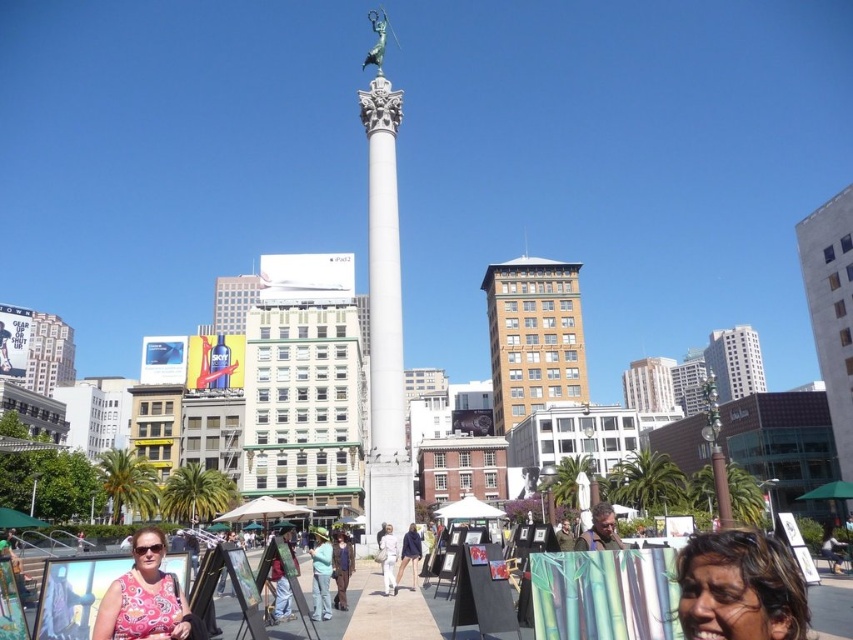
Does light blue denim jeans at center appear on the right side of white cotton pants at center?

Incorrect, light blue denim jeans at center is not on the right side of white cotton pants at center.

Is point (335, 605) less distant than point (387, 545)?

Yes.

Locate an element on the screen. Image resolution: width=853 pixels, height=640 pixels. light blue denim jeans at center is located at coordinates (341, 568).

Is denim pants at center behind white cotton pants at center?

No, denim pants at center is closer to the viewer.

Between point (321, 593) and point (381, 536), which one is positioned in front?

Point (321, 593) is more forward.

Is point (312, 618) closer to camera compared to point (386, 566)?

Yes.

You are a GUI agent. You are given a task and a screenshot of the screen. Output one action in this format:
    pyautogui.click(x=<x>, y=<y>)
    Task: Click on the denim pants at center
    This screenshot has height=640, width=853.
    Given the screenshot: What is the action you would take?
    pyautogui.click(x=321, y=573)

Who is higher up, pink fabric at lower left or matte brown jacket at lower right?

pink fabric at lower left

Between point (149, 577) and point (598, 515), which one is positioned behind?

The point (598, 515) is behind.

Where is `pink fabric at lower left`? pink fabric at lower left is located at coordinates (144, 596).